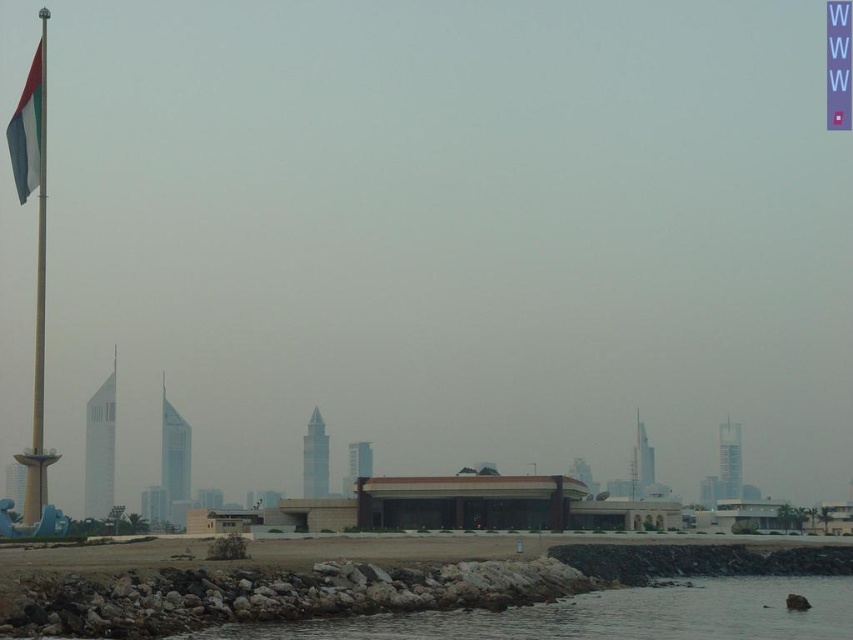
Which is below, gray rocky water at lower left or white fabric flag at left?

Positioned lower is gray rocky water at lower left.

Is point (727, 611) positioned before point (32, 113)?

Yes, point (727, 611) is in front of point (32, 113).

The width and height of the screenshot is (853, 640). In order to click on gray rocky water at lower left in this screenshot , I will do `click(605, 616)`.

Does gray rocky water at lower left have a lesser height compared to polished metal flag pole at left?

Yes.

I want to click on gray rocky water at lower left, so click(605, 616).

I want to click on gray rocky water at lower left, so click(x=605, y=616).

Can you confirm if polished metal flag pole at left is positioned to the left of white fabric flag at left?

Indeed, polished metal flag pole at left is positioned on the left side of white fabric flag at left.

Is polished metal flag pole at left bigger than white fabric flag at left?

Indeed, polished metal flag pole at left has a larger size compared to white fabric flag at left.

I want to click on polished metal flag pole at left, so click(x=36, y=252).